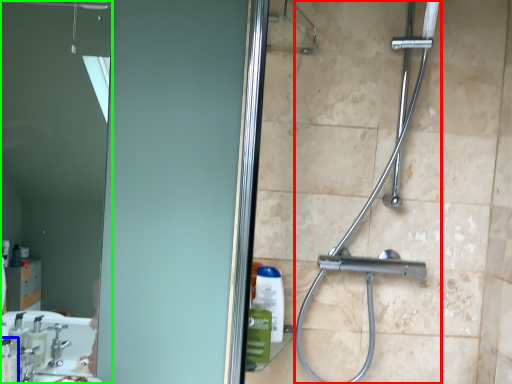
Question: Which is farther away from shower (highlighted by a red box)? soap dispenser (highlighted by a blue box) or mirror (highlighted by a green box)?

Choices:
 (A) soap dispenser
 (B) mirror

Answer: (B)